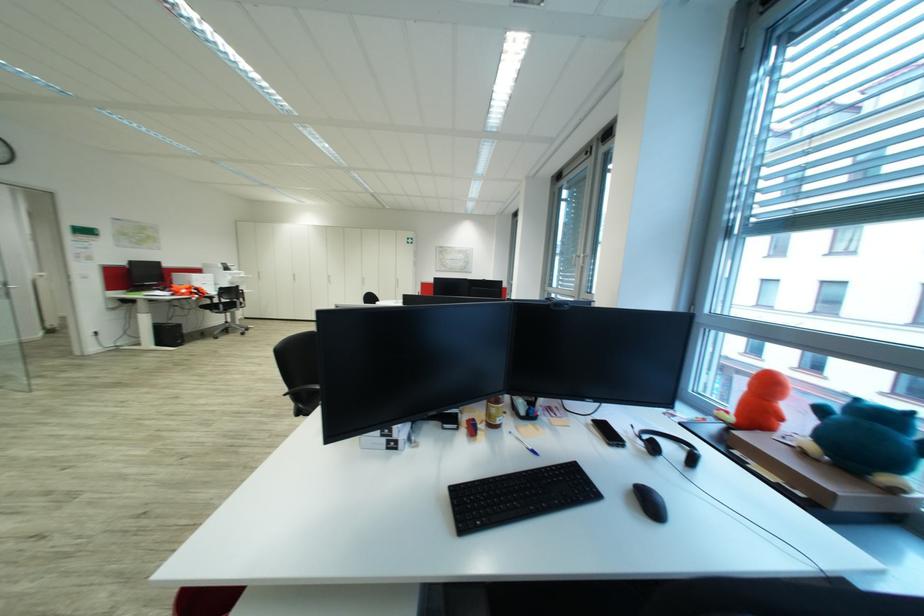
What do you see at coordinates (301, 389) in the screenshot?
I see `the black chair armrest` at bounding box center [301, 389].